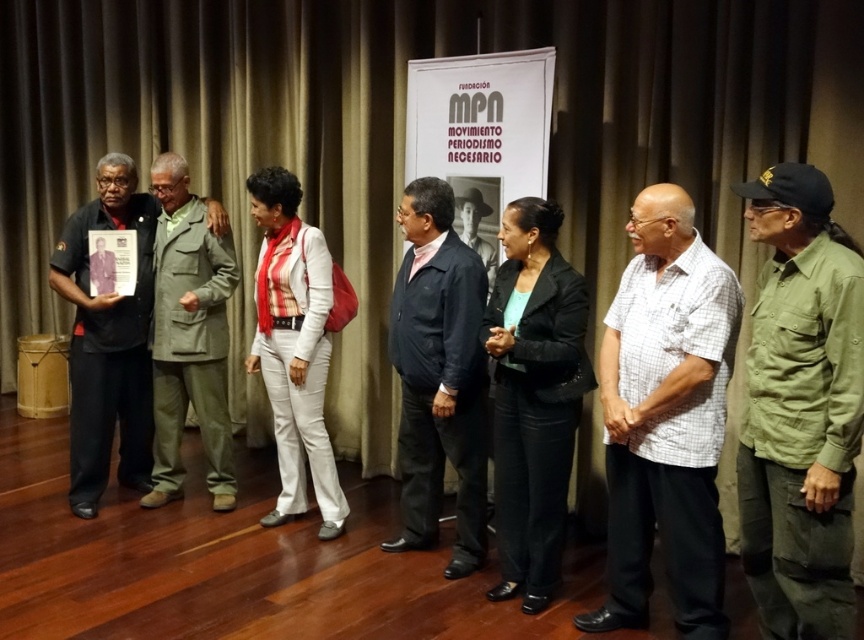
You are organizing a photo shoot and need to arrange the dark blue jacket at center and the dark green uniform at left on a rack. Based on their sizes, which one should you place first to maximize space efficiency?

The dark blue jacket at center has a lesser width compared to the dark green uniform at left, so you should place the dark green uniform at left first to maximize space efficiency by starting with the larger item.

You are organizing a photo shoot and need to arrange the white checkered shirt at center and the matte black photo at left in a display case. Given their sizes, which one should you place first to ensure both fit properly?

The white checkered shirt at center is larger than the matte black photo at left, so you should place the white checkered shirt at center first to ensure both fit properly in the display case.

You are a photographer positioned at the back of the stage. You need to capture a photo that includes both the dark green uniform at left and the matte white pants at center. Which object should you focus on first to ensure both are in frame?

You should focus on the dark green uniform at left first because it is closer to you than the matte white pants at center, ensuring both are in frame.